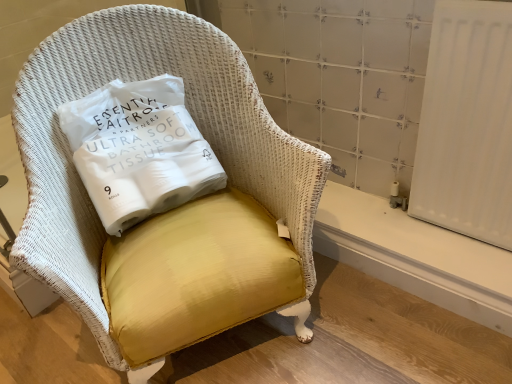
Question: Is white smooth radiator at lower right in front of or behind yellow fabric pillow at center in the image?

Choices:
 (A) behind
 (B) front

Answer: (A)

Question: From the image's perspective, is white smooth radiator at lower right positioned above or below yellow fabric pillow at center?

Choices:
 (A) above
 (B) below

Answer: (B)

Question: Estimate the real-world distances between objects in this image. Which object is farther from the yellow fabric chair at center?

Choices:
 (A) yellow fabric pillow at center
 (B) white smooth radiator at lower right

Answer: (B)

Question: Estimate the real-world distances between objects in this image. Which object is farther from the yellow fabric pillow at center?

Choices:
 (A) white smooth radiator at lower right
 (B) yellow fabric chair at center

Answer: (A)